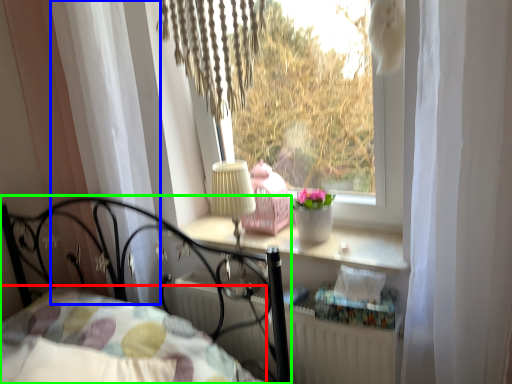
Question: Which object is positioned farthest from bedding (highlighted by a red box)? Select from curtain (highlighted by a blue box) and bed (highlighted by a green box).

Choices:
 (A) curtain
 (B) bed

Answer: (A)